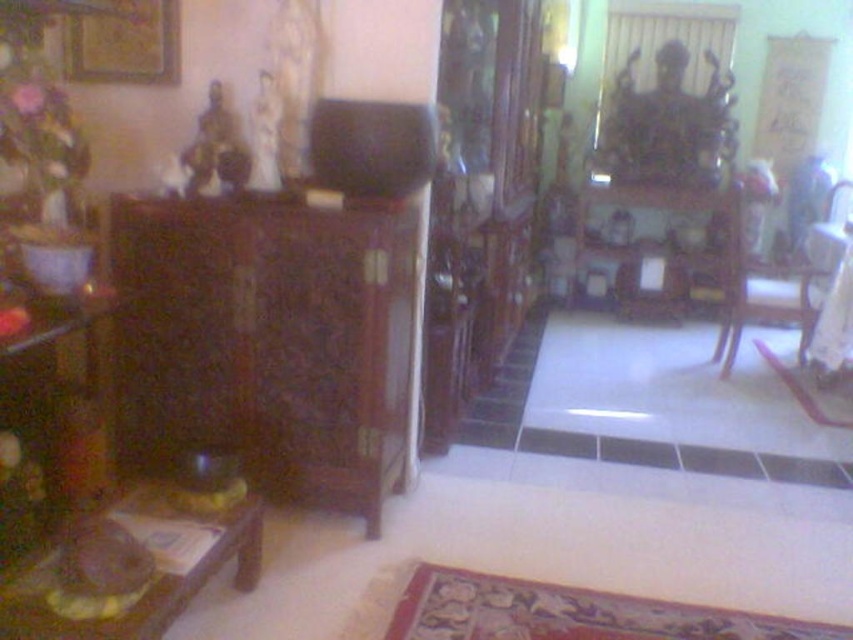
Between wooden tray at lower left and wooden picture frame at upper left, which one is positioned higher?

wooden picture frame at upper left is above.

Between wooden tray at lower left and wooden picture frame at upper left, which one has less height?

wooden picture frame at upper left

Who is more forward, (234, 508) or (148, 42)?

Point (234, 508)

Locate an element on the screen. This screenshot has height=640, width=853. wooden tray at lower left is located at coordinates (157, 570).

Does dark wood dresser at left appear on the left side of wooden tray at lower left?

In fact, dark wood dresser at left is to the right of wooden tray at lower left.

Can you confirm if dark wood dresser at left is smaller than wooden tray at lower left?

Actually, dark wood dresser at left might be larger than wooden tray at lower left.

The width and height of the screenshot is (853, 640). In order to click on dark wood dresser at left in this screenshot , I will do `click(268, 340)`.

From the picture: Can you confirm if dark wood dresser at left is wider than wooden armchair at center?

Indeed, dark wood dresser at left has a greater width compared to wooden armchair at center.

Is dark wood dresser at left to the right of wooden armchair at center from the viewer's perspective?

In fact, dark wood dresser at left is to the left of wooden armchair at center.

Who is more distant from viewer, (260, 316) or (772, 305)?

The point (772, 305) is more distant.

At what (x,y) coordinates should I click in order to perform the action: click on dark wood dresser at left. Please return your answer as a coordinate pair (x, y). Looking at the image, I should click on (268, 340).